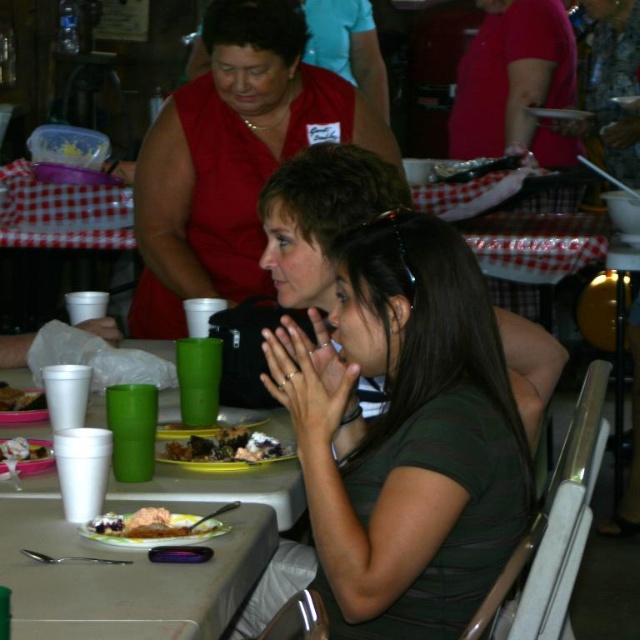
Based on the photo, you are at a social gathering and want to know which of the two points, point (193, 528) or point (22, 403), is closer to you. Based on the scene description, can you determine which point is nearer?

Point (193, 528) is in front of point (22, 403), so it is closer to you.

You are a server at the diner and need to place a new plate on the table. The plate you have is the same size as the shiny plastic fork at upper left. Can you fit it next to the yellowish matte plate at lower left without overlapping?

The yellowish matte plate at lower left is wider than the shiny plastic fork at upper left. Since your new plate is the same size as the fork, it will be smaller than the existing plate. You can place it next to the plate without overlapping, as there should be enough space.